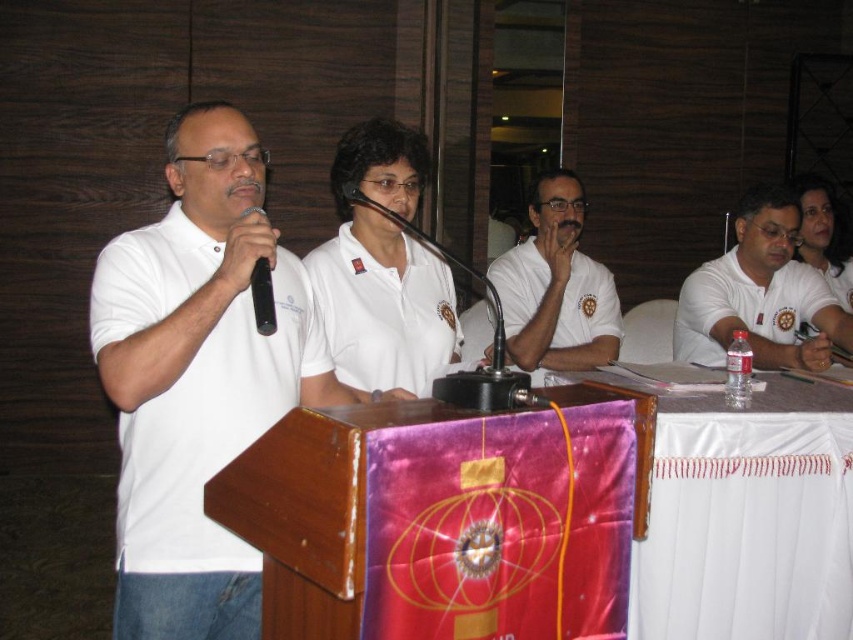
Question: Which point is farther to the camera?

Choices:
 (A) (352, 339)
 (B) (254, 285)
 (C) (779, 260)
 (D) (505, 282)

Answer: (D)

Question: Estimate the real-world distances between objects in this image. Which object is closer to the white matte shirt at center?

Choices:
 (A) white matte polo shirt at left
 (B) white matte shirt at right
 (C) black plastic microphone at left
 (D) white matte polo shirt at center

Answer: (B)

Question: Can you confirm if white matte polo shirt at center is positioned below black plastic microphone at left?

Choices:
 (A) yes
 (B) no

Answer: (A)

Question: Considering the real-world distances, which object is farthest from the white matte polo shirt at center?

Choices:
 (A) white matte shirt at right
 (B) white matte shirt at center

Answer: (A)

Question: Is white matte polo shirt at left below white matte shirt at center?

Choices:
 (A) no
 (B) yes

Answer: (B)

Question: Can you confirm if white matte polo shirt at left is positioned to the right of white matte shirt at right?

Choices:
 (A) no
 (B) yes

Answer: (A)